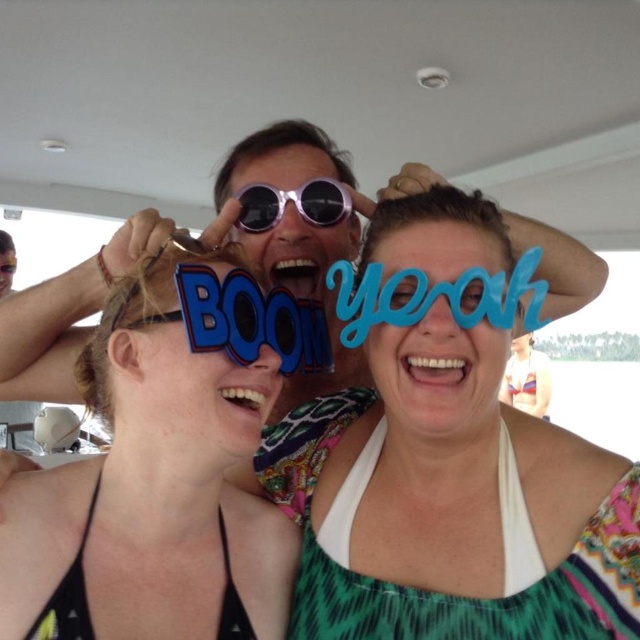
You are at a party on a boat and want to take a photo with the blue paper sign at center and the matte plastic sunglasses at center. Which object should you hold higher to make sure both are visible in the photo?

The blue paper sign at center is taller than the matte plastic sunglasses at center, so you should hold the blue paper sign at center higher to ensure both are visible in the photo.

You are at a party on a boat and want to take a photo of the blue paper sign at center and the sunglasses at center. Which object is positioned closer to the camera?

The blue paper sign at center is closer to the viewer than the sunglasses at center, so the blue paper sign at center would appear closer in the photo.

You are trying to decide which object is wider between the blue paper sign at center and the matte plastic sunglasses at center. Based on the scene, can you determine which one is wider?

The blue paper sign at center is wider than matte plastic sunglasses at center according to the description.